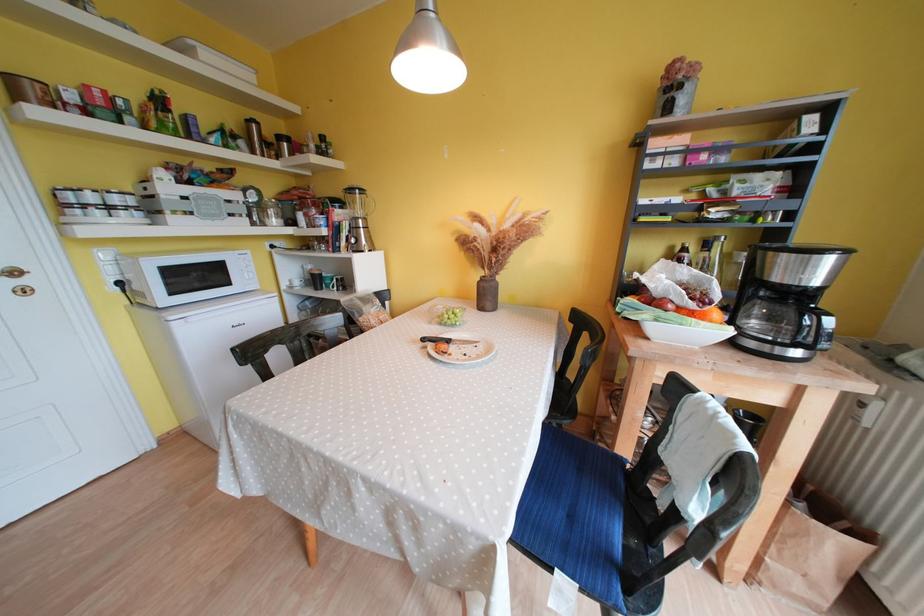
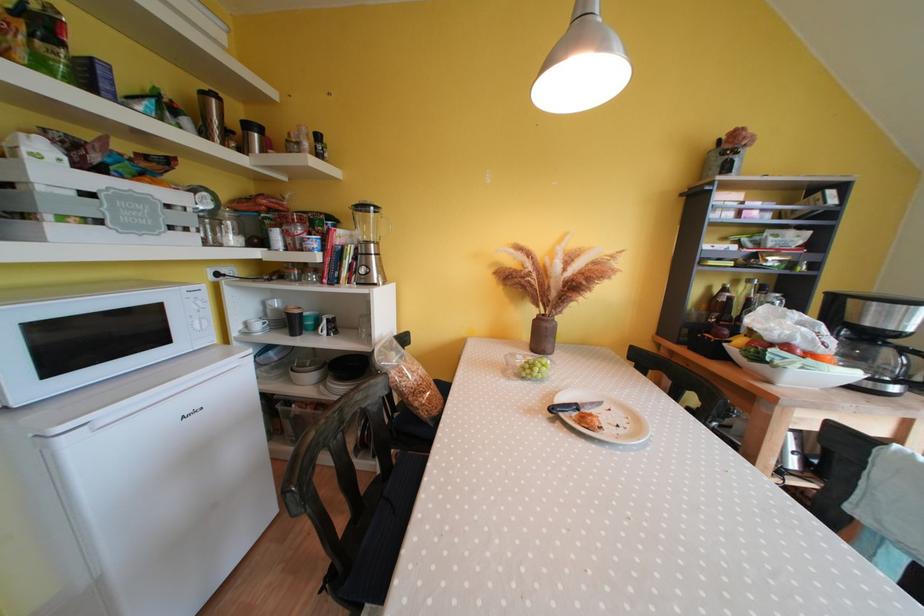
Question: How did the camera likely rotate?

Choices:
 (A) Left
 (B) Right
 (C) Up
 (D) Down

Answer: (B)